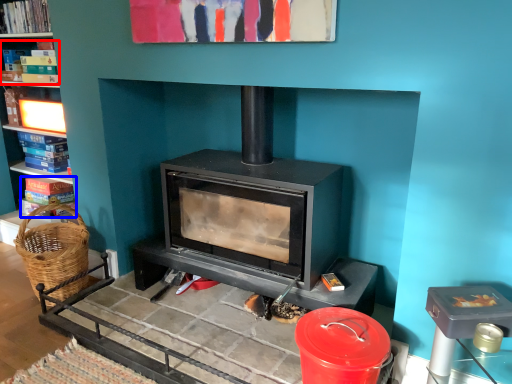
Question: Which of the following is the farthest to the observer, book (highlighted by a red box) or book (highlighted by a blue box)?

Choices:
 (A) book
 (B) book

Answer: (B)